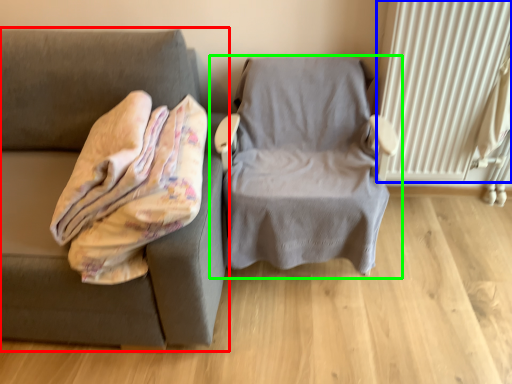
Question: Which object is positioned farthest from studio couch (highlighted by a red box)? Select from radiator (highlighted by a blue box) and chair (highlighted by a green box).

Choices:
 (A) radiator
 (B) chair

Answer: (A)